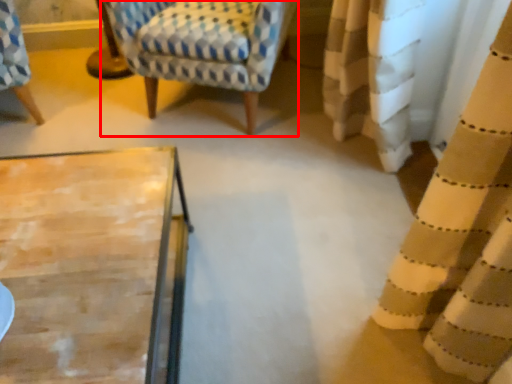
Question: In this image, where is rocking chair (annotated by the red box) located relative to curtain?

Choices:
 (A) right
 (B) left

Answer: (B)